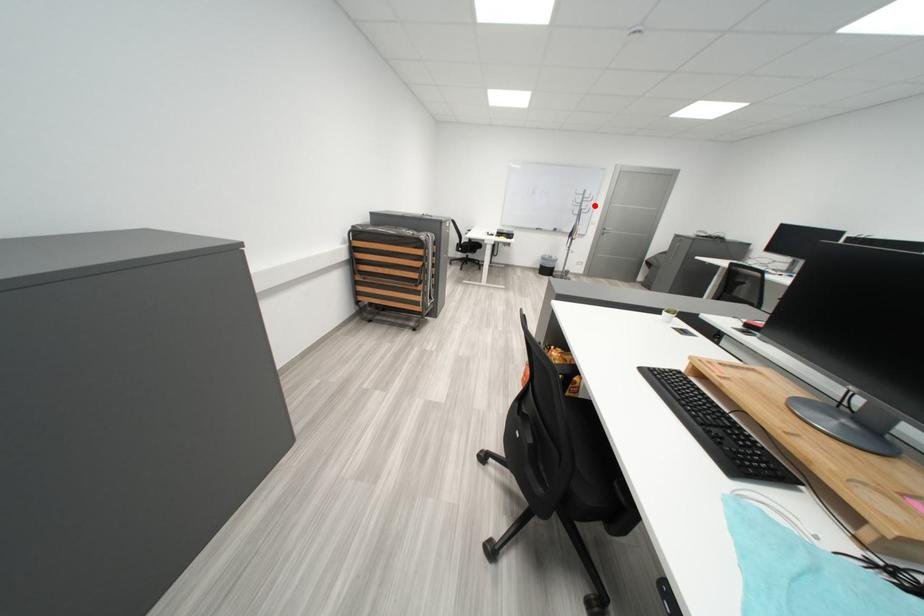
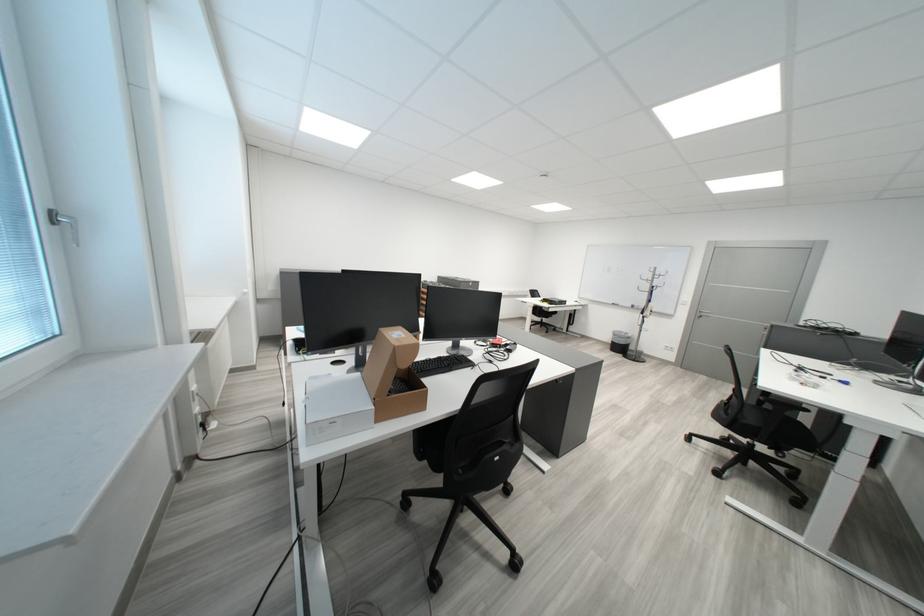
The point at the highlighted location is marked in the first image. Where is the corresponding point in the second image?

(665, 283)